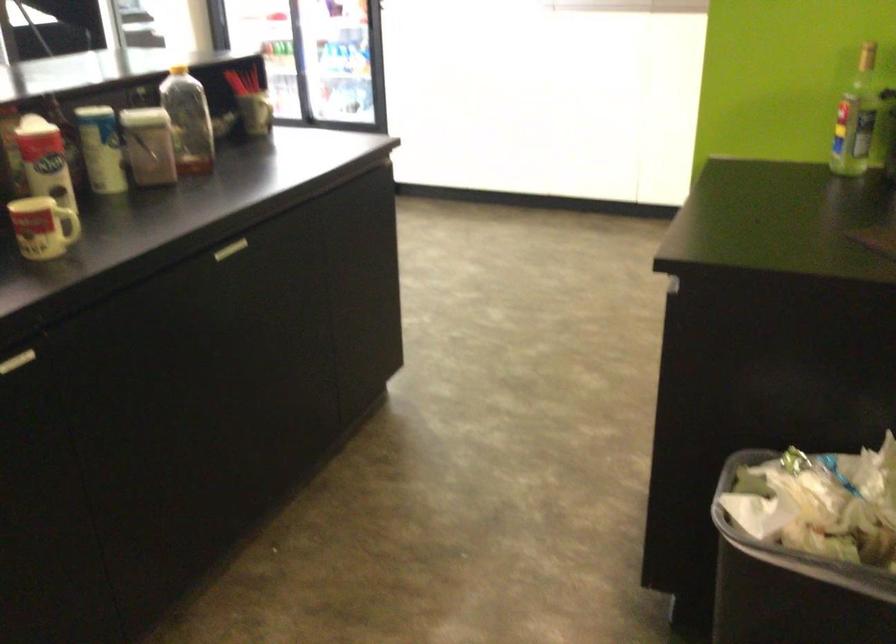
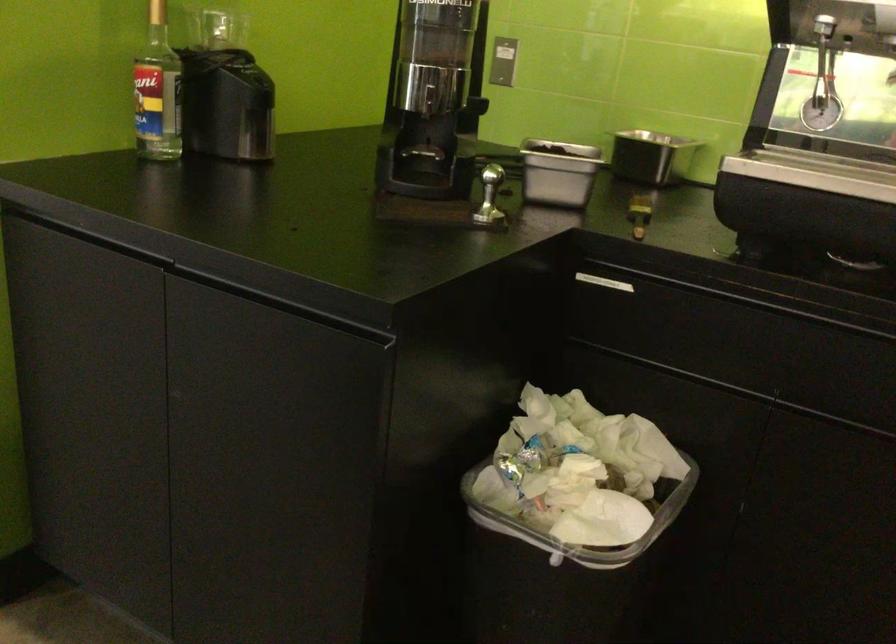
Find the pixel in the second image that matches the point at 763,507 in the first image.

(581, 524)